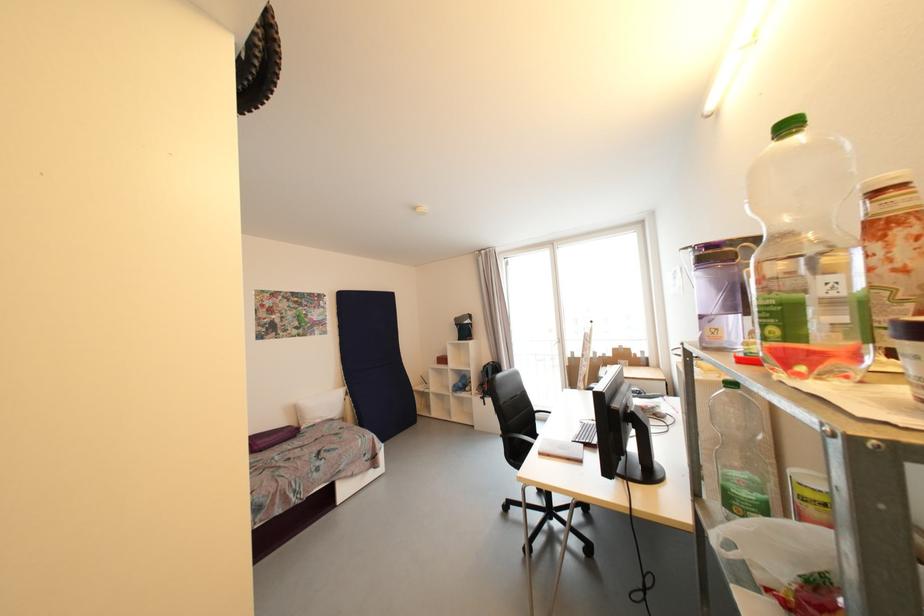
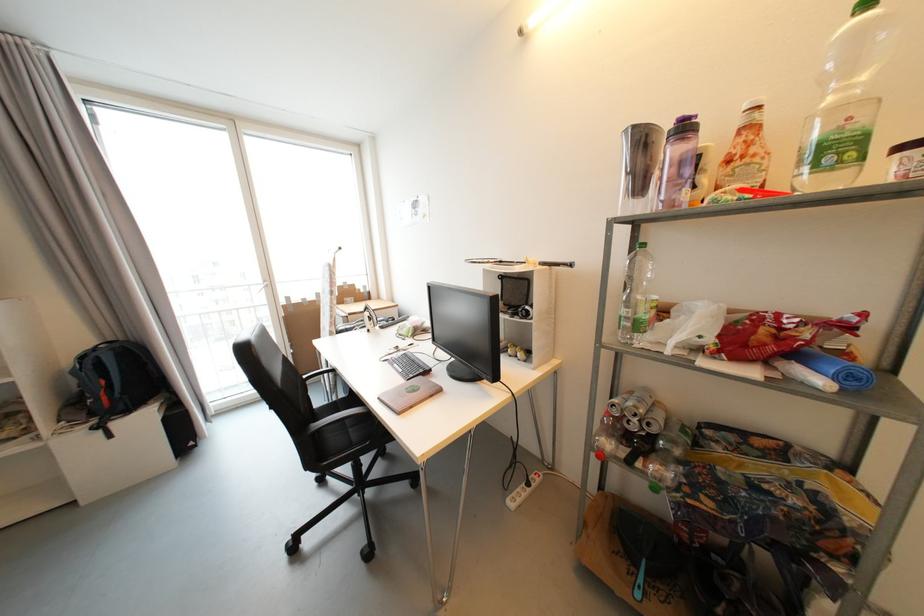
Question: The camera is either moving clockwise (left) or counter-clockwise (right) around the object. The first image is from the beginning of the video and the second image is from the end. Is the camera moving left or right when shooting the video?

Choices:
 (A) Left
 (B) Right

Answer: (A)